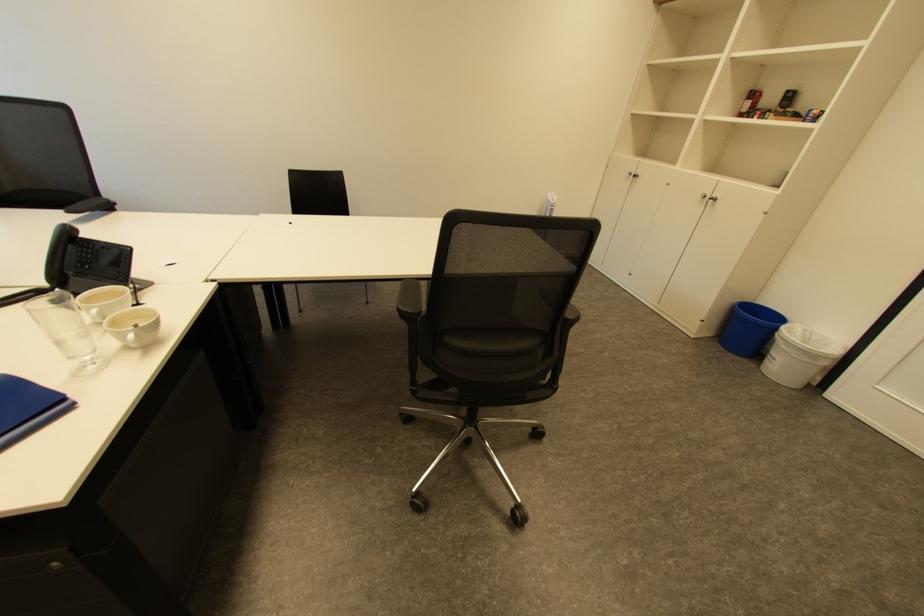
Locate an element on the screen. telephone handset is located at coordinates (91, 251).